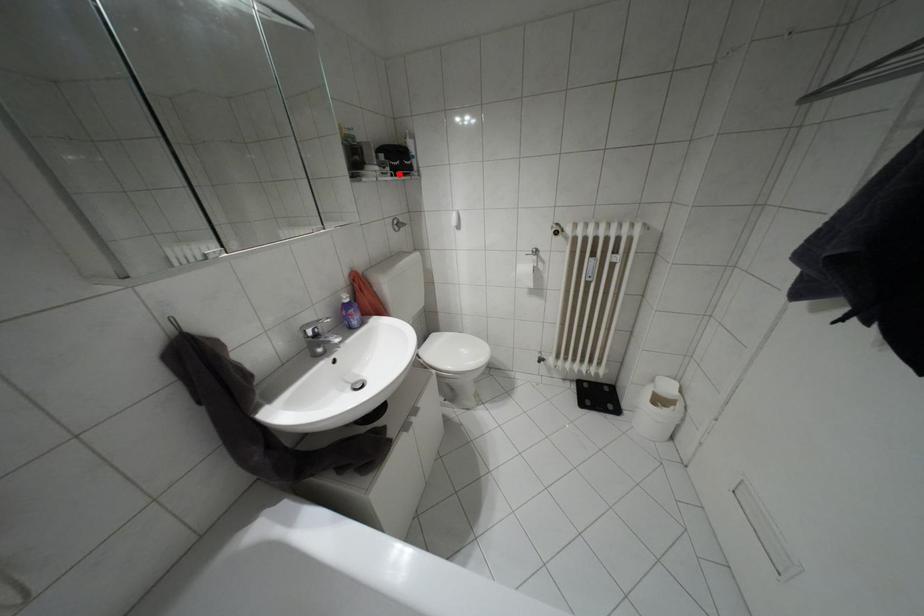
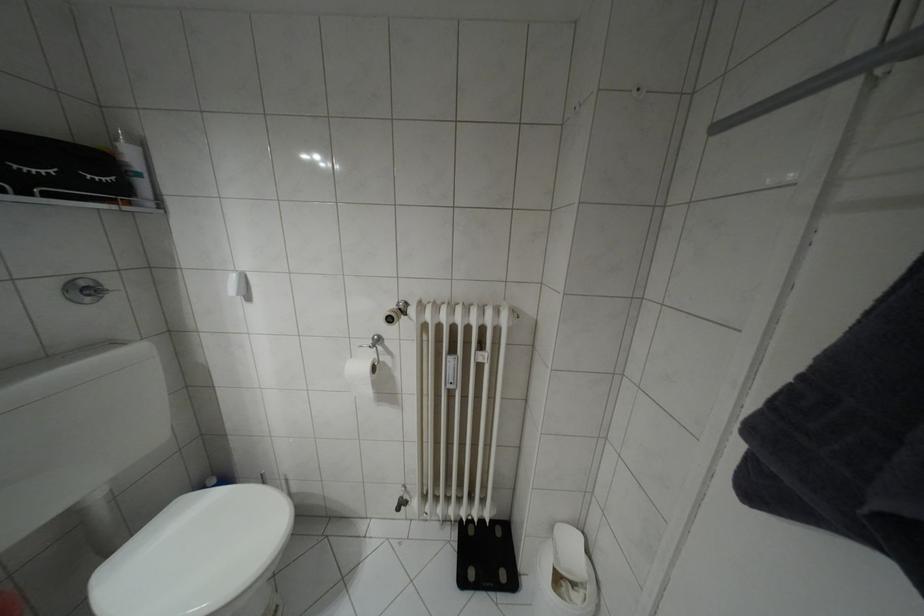
Question: I am providing you with two images of the same scene from different viewpoints. A red point is shown in image1. For the corresponding object point in image2, is it positioned nearer or farther from the camera?

Choices:
 (A) Nearer
 (B) Farther

Answer: (B)